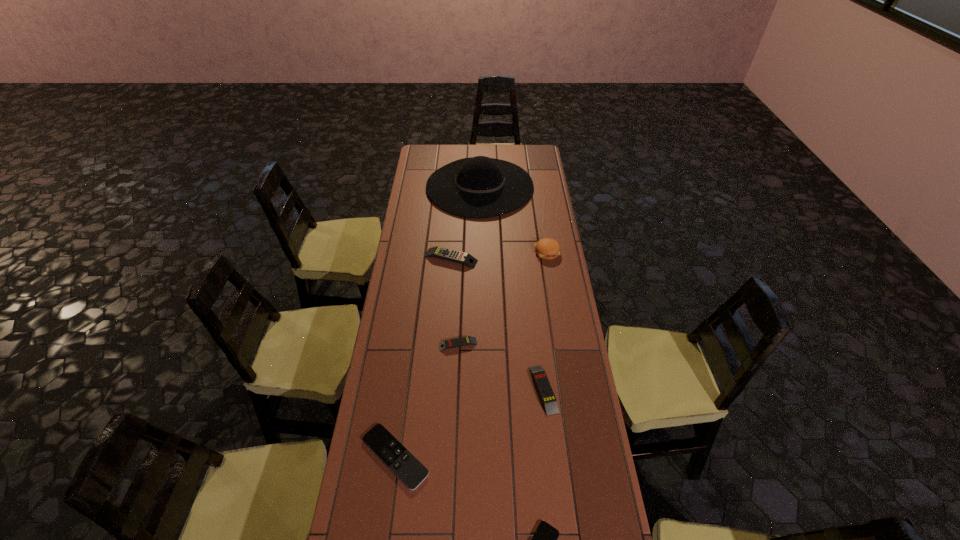
What are the coordinates of `sombrero` in the screenshot? It's located at coord(478,187).

The width and height of the screenshot is (960, 540). What are the coordinates of `the farthest object` in the screenshot? It's located at (478, 187).

Where is `patty`? patty is located at coordinates (546, 248).

The height and width of the screenshot is (540, 960). In order to click on the farthest remote control in this screenshot , I will do `click(443, 253)`.

This screenshot has width=960, height=540. What are the coordinates of `the biggest yellow remote control` in the screenshot? It's located at (443, 253).

You are a GUI agent. You are given a task and a screenshot of the screen. Output one action in this format:
    pyautogui.click(x=<x>, y=<y>)
    Task: Click on the fourth shortest remote control
    The height and width of the screenshot is (540, 960).
    Given the screenshot: What is the action you would take?
    pyautogui.click(x=541, y=380)

Where is `the second biggest yellow remote control`? Image resolution: width=960 pixels, height=540 pixels. the second biggest yellow remote control is located at coordinates (541, 380).

Image resolution: width=960 pixels, height=540 pixels. I want to click on the fourth nearest remote control, so click(467, 340).

At what (x,y) coordinates should I click in order to perform the action: click on the third shortest object. Please return your answer as a coordinate pair (x, y). The width and height of the screenshot is (960, 540). Looking at the image, I should click on (467, 340).

Image resolution: width=960 pixels, height=540 pixels. I want to click on the farther black remote control, so click(400, 461).